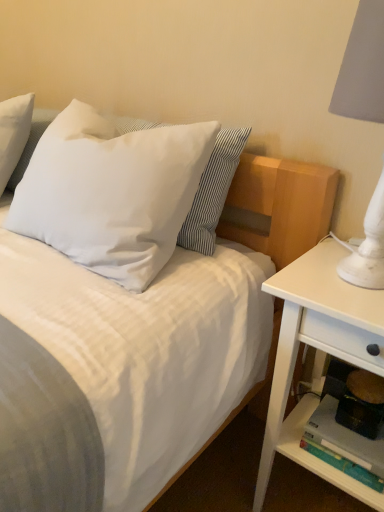
Question: Is matte plastic shelf at lower right inside white soft pillow at upper left, placed as the 1th pillow when sorted from right to left?

Choices:
 (A) no
 (B) yes

Answer: (A)

Question: Can you confirm if white soft pillow at upper left, acting as the second pillow starting from the left, is wider than matte plastic shelf at lower right?

Choices:
 (A) no
 (B) yes

Answer: (B)

Question: Is white soft pillow at upper left, acting as the second pillow starting from the left, closer to the viewer compared to matte plastic shelf at lower right?

Choices:
 (A) no
 (B) yes

Answer: (B)

Question: From a real-world perspective, is white soft pillow at upper left, placed as the 1th pillow when sorted from right to left, located higher than matte plastic shelf at lower right?

Choices:
 (A) yes
 (B) no

Answer: (A)

Question: Considering the relative sizes of white soft pillow at upper left, placed as the 1th pillow when sorted from right to left, and matte plastic shelf at lower right in the image provided, is white soft pillow at upper left, placed as the 1th pillow when sorted from right to left, thinner than matte plastic shelf at lower right?

Choices:
 (A) yes
 (B) no

Answer: (B)

Question: Does white soft pillow at upper left, placed as the 1th pillow when sorted from right to left, appear on the right side of matte plastic shelf at lower right?

Choices:
 (A) no
 (B) yes

Answer: (A)

Question: Is white wood nightstand at right turned away from white matte pillow at upper left, the 1th pillow in the left-to-right sequence?

Choices:
 (A) no
 (B) yes

Answer: (A)

Question: Is white wood nightstand at right to the right of white matte pillow at upper left, the 1th pillow in the left-to-right sequence, from the viewer's perspective?

Choices:
 (A) yes
 (B) no

Answer: (A)

Question: Can you confirm if white wood nightstand at right is shorter than white matte pillow at upper left, positioned as the 2th pillow in right-to-left order?

Choices:
 (A) yes
 (B) no

Answer: (B)

Question: From a real-world perspective, is white wood nightstand at right beneath white matte pillow at upper left, positioned as the 2th pillow in right-to-left order?

Choices:
 (A) yes
 (B) no

Answer: (A)

Question: Can you confirm if white wood nightstand at right is bigger than white matte pillow at upper left, positioned as the 2th pillow in right-to-left order?

Choices:
 (A) yes
 (B) no

Answer: (A)

Question: Could you tell me if white wood nightstand at right is turned towards white matte pillow at upper left, positioned as the 2th pillow in right-to-left order?

Choices:
 (A) yes
 (B) no

Answer: (B)

Question: Considering the relative sizes of white wood nightstand at right and white soft pillow at upper left, placed as the 1th pillow when sorted from right to left, in the image provided, is white wood nightstand at right shorter than white soft pillow at upper left, placed as the 1th pillow when sorted from right to left,?

Choices:
 (A) yes
 (B) no

Answer: (B)